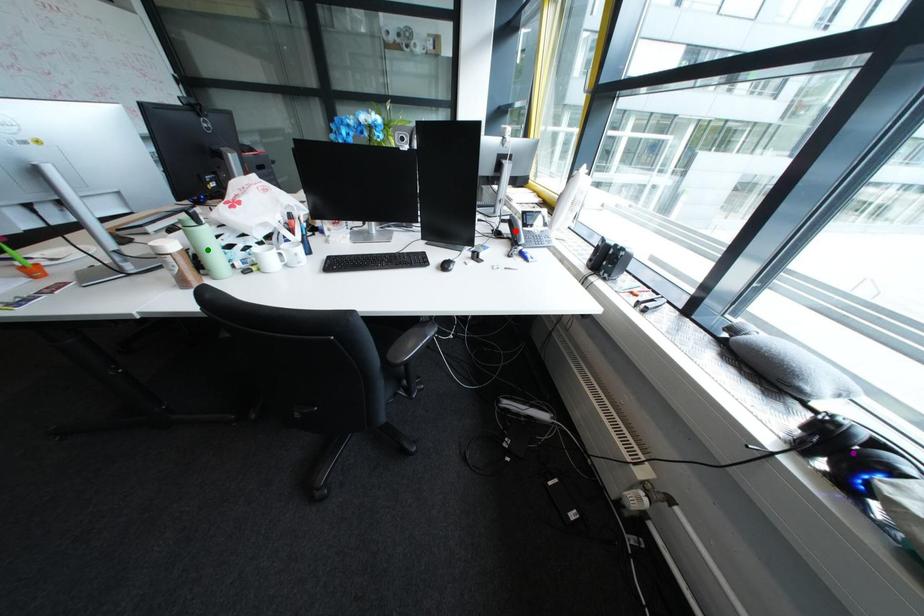
Based on the photo, order these from nearest to farthest:
red point | purple point | green point

red point < green point < purple point